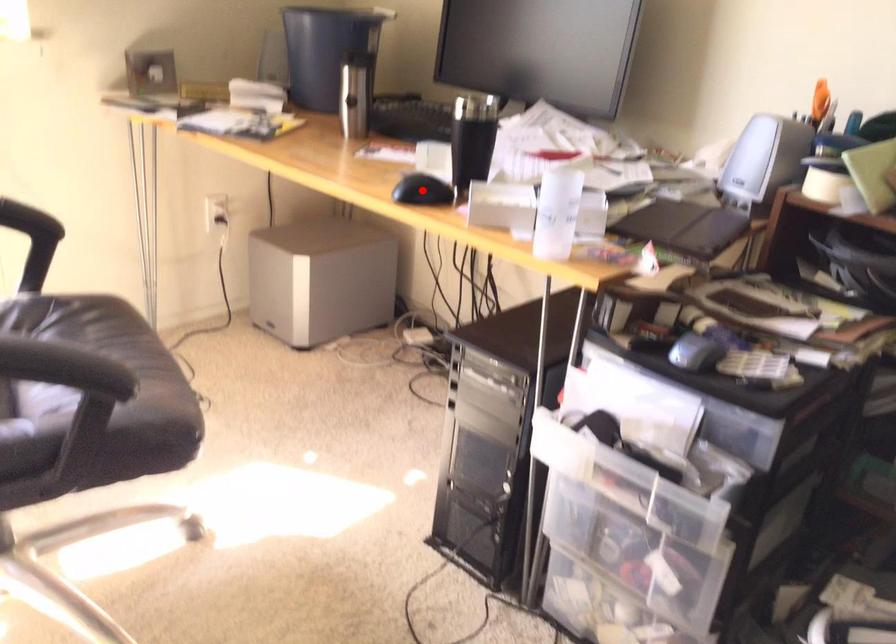
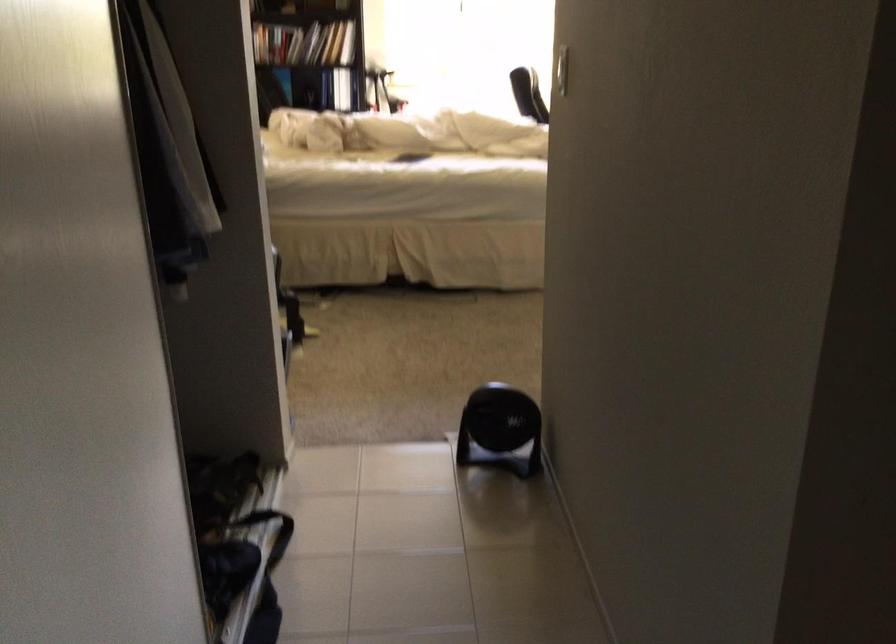
Question: I am providing you with two images of the same scene from different viewpoints. A red point is marked on the first image. Can you still see the location of the red point in image 2?

Choices:
 (A) Yes
 (B) No

Answer: (B)